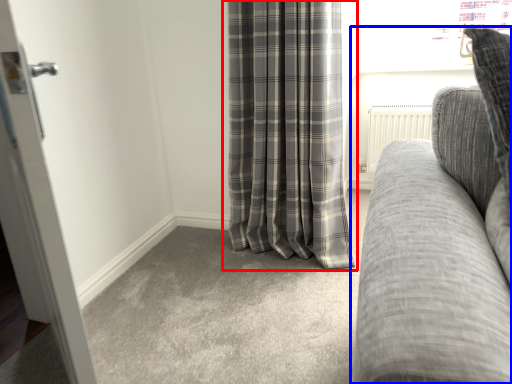
Question: Among these objects, which one is nearest to the camera, curtain (highlighted by a red box) or studio couch (highlighted by a blue box)?

Choices:
 (A) curtain
 (B) studio couch

Answer: (B)